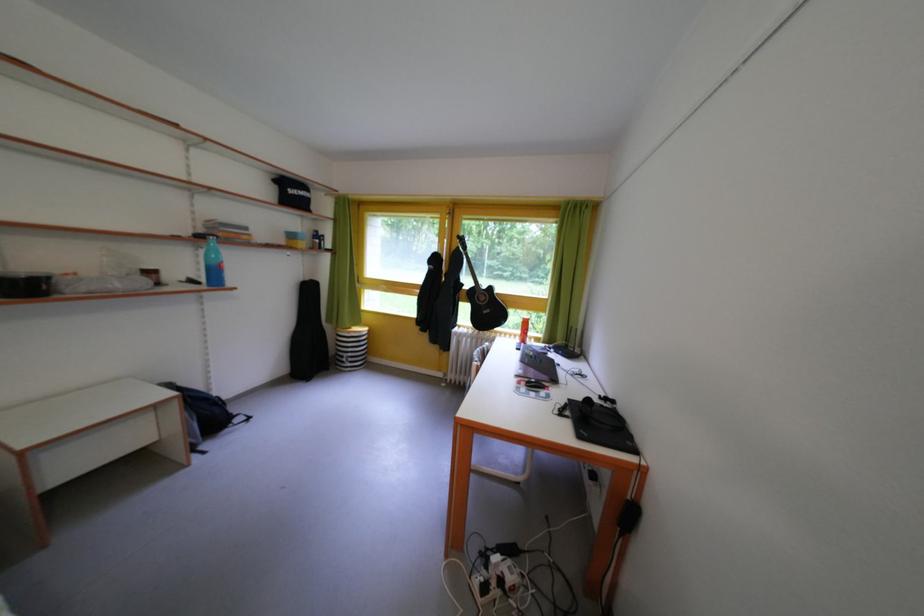
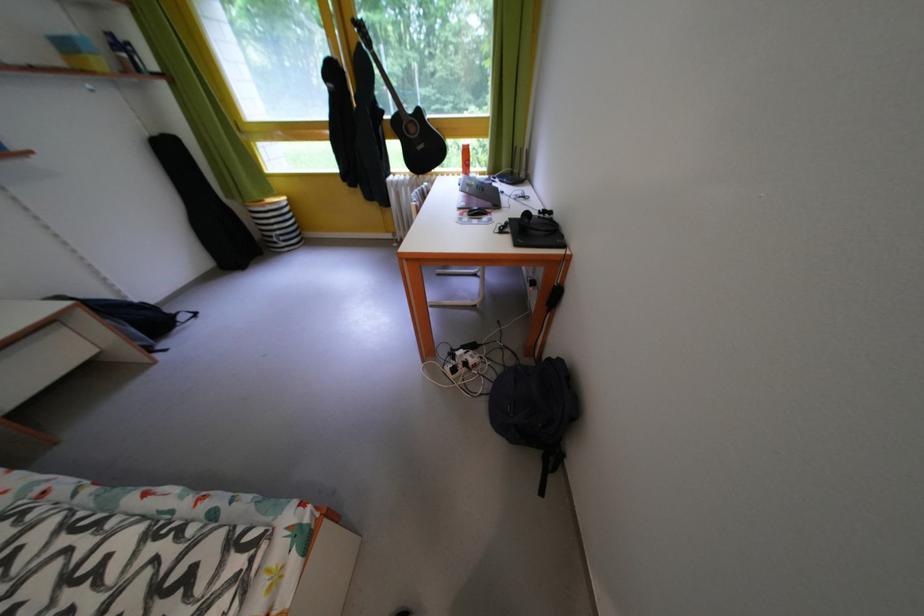
Where in the second image is the point corresponding to point 472,291 from the first image?

(393, 118)